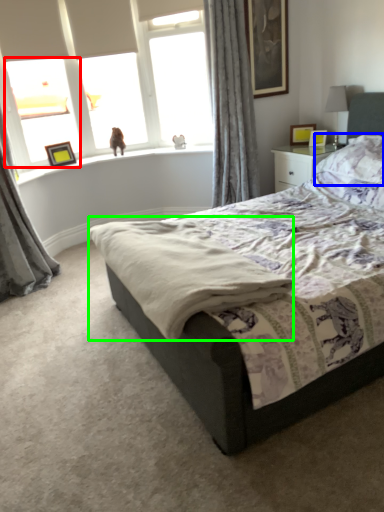
Question: Estimate the real-world distances between objects in this image. Which object is closer to window (highlighted by a red box), pillow (highlighted by a blue box) or cloth (highlighted by a green box)?

Choices:
 (A) pillow
 (B) cloth

Answer: (B)